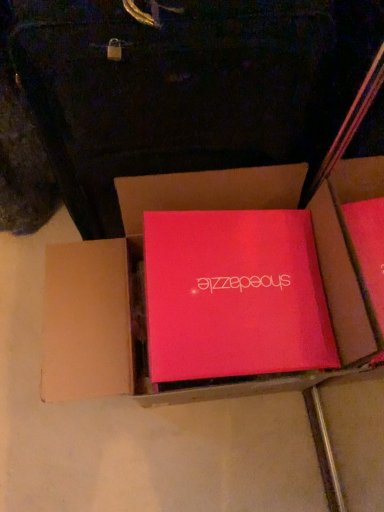
The image size is (384, 512). I want to click on matte pink box at center, arranged as the 2th box when viewed from the left, so click(x=234, y=295).

What do you see at coordinates (234, 295) in the screenshot? I see `matte pink box at center, arranged as the 2th box when viewed from the left` at bounding box center [234, 295].

At what (x,y) coordinates should I click in order to perform the action: click on matte red box at center, which is the 2th box from right to left. Please return your answer as a coordinate pair (x, y). This screenshot has height=512, width=384. Looking at the image, I should click on (218, 286).

What do you see at coordinates (218, 286) in the screenshot? I see `matte red box at center, the 1th box viewed from the left` at bounding box center [218, 286].

Identify the location of matte pink box at center, the 1th box in the right-to-left sequence. This screenshot has width=384, height=512. (234, 295).

Between matte red box at center, the 1th box viewed from the left, and matte pink box at center, the 1th box in the right-to-left sequence, which one appears on the left side from the viewer's perspective?

From the viewer's perspective, matte red box at center, the 1th box viewed from the left, appears more on the left side.

Looking at this image, who is more distant, matte red box at center, the 1th box viewed from the left, or matte pink box at center, arranged as the 2th box when viewed from the left?

matte pink box at center, arranged as the 2th box when viewed from the left, is more distant.

Considering the positions of point (71, 250) and point (239, 264), is point (71, 250) closer or farther from the camera than point (239, 264)?

Point (71, 250) is farther from the camera than point (239, 264).

From the image's perspective, which one is positioned lower, matte red box at center, which is the 2th box from right to left, or matte pink box at center, arranged as the 2th box when viewed from the left?

matte red box at center, which is the 2th box from right to left, from the image's perspective.

From a real-world perspective, is matte red box at center, which is the 2th box from right to left, located higher than matte pink box at center, the 1th box in the right-to-left sequence?

No, from a real-world perspective, matte red box at center, which is the 2th box from right to left, is not above matte pink box at center, the 1th box in the right-to-left sequence.

Can you confirm if matte red box at center, which is the 2th box from right to left, is thinner than matte pink box at center, the 1th box in the right-to-left sequence?

In fact, matte red box at center, which is the 2th box from right to left, might be wider than matte pink box at center, the 1th box in the right-to-left sequence.

Is matte red box at center, the 1th box viewed from the left, taller than matte pink box at center, arranged as the 2th box when viewed from the left?

Yes.

Who is smaller, matte red box at center, the 1th box viewed from the left, or matte pink box at center, arranged as the 2th box when viewed from the left?

Smaller between the two is matte pink box at center, arranged as the 2th box when viewed from the left.

Looking at this image, would you say matte red box at center, which is the 2th box from right to left, is inside or outside matte pink box at center, the 1th box in the right-to-left sequence?

matte red box at center, which is the 2th box from right to left, exists outside the volume of matte pink box at center, the 1th box in the right-to-left sequence.

Are matte red box at center, the 1th box viewed from the left, and matte pink box at center, the 1th box in the right-to-left sequence, making contact?

Yes, matte red box at center, the 1th box viewed from the left, is right next to matte pink box at center, the 1th box in the right-to-left sequence, and making contact.

Is matte red box at center, the 1th box viewed from the left, oriented towards matte pink box at center, arranged as the 2th box when viewed from the left?

Yes, matte red box at center, the 1th box viewed from the left, is facing matte pink box at center, arranged as the 2th box when viewed from the left.

What's the angular difference between matte red box at center, the 1th box viewed from the left, and matte pink box at center, arranged as the 2th box when viewed from the left,'s facing directions?

The angular difference between matte red box at center, the 1th box viewed from the left, and matte pink box at center, arranged as the 2th box when viewed from the left, is 4.69 degrees.

How distant is matte red box at center, the 1th box viewed from the left, from matte pink box at center, the 1th box in the right-to-left sequence?

matte red box at center, the 1th box viewed from the left, and matte pink box at center, the 1th box in the right-to-left sequence, are 1.88 inches apart from each other.

You are a GUI agent. You are given a task and a screenshot of the screen. Output one action in this format:
    pyautogui.click(x=<x>, y=<y>)
    Task: Click on the box on the left of matte pink box at center, arranged as the 2th box when viewed from the left
    The image size is (384, 512).
    Given the screenshot: What is the action you would take?
    pyautogui.click(x=218, y=286)

Is matte pink box at center, the 1th box in the right-to-left sequence, to the right of matte red box at center, the 1th box viewed from the left, from the viewer's perspective?

Yes.

Which object is closer to the camera, matte pink box at center, the 1th box in the right-to-left sequence, or matte red box at center, which is the 2th box from right to left?

matte red box at center, which is the 2th box from right to left, is more forward.

Is point (293, 224) positioned after point (366, 183)?

That is False.

From the image's perspective, relative to matte red box at center, the 1th box viewed from the left, is matte pink box at center, the 1th box in the right-to-left sequence, above or below?

From the image's perspective, matte pink box at center, the 1th box in the right-to-left sequence, appears above matte red box at center, the 1th box viewed from the left.

From a real-world perspective, between matte pink box at center, arranged as the 2th box when viewed from the left, and matte red box at center, which is the 2th box from right to left, who is vertically higher?

matte pink box at center, arranged as the 2th box when viewed from the left, from a real-world perspective.

Looking at their sizes, would you say matte pink box at center, the 1th box in the right-to-left sequence, is wider or thinner than matte red box at center, which is the 2th box from right to left?

matte pink box at center, the 1th box in the right-to-left sequence, is thinner than matte red box at center, which is the 2th box from right to left.

From their relative heights in the image, would you say matte pink box at center, the 1th box in the right-to-left sequence, is taller or shorter than matte red box at center, the 1th box viewed from the left?

In the image, matte pink box at center, the 1th box in the right-to-left sequence, appears to be shorter than matte red box at center, the 1th box viewed from the left.

Who is smaller, matte pink box at center, arranged as the 2th box when viewed from the left, or matte red box at center, the 1th box viewed from the left?

With smaller size is matte pink box at center, arranged as the 2th box when viewed from the left.

Looking at this image, is matte red box at center, the 1th box viewed from the left, a part of matte pink box at center, arranged as the 2th box when viewed from the left?

Actually, matte red box at center, the 1th box viewed from the left, is outside matte pink box at center, arranged as the 2th box when viewed from the left.

Is matte pink box at center, arranged as the 2th box when viewed from the left, next to matte red box at center, the 1th box viewed from the left?

Yes, matte pink box at center, arranged as the 2th box when viewed from the left, is next to matte red box at center, the 1th box viewed from the left.

Is matte pink box at center, the 1th box in the right-to-left sequence, oriented away from matte red box at center, the 1th box viewed from the left?

That's right, matte pink box at center, the 1th box in the right-to-left sequence, is facing away from matte red box at center, the 1th box viewed from the left.

Measure the distance between matte pink box at center, arranged as the 2th box when viewed from the left, and matte red box at center, which is the 2th box from right to left.

matte pink box at center, arranged as the 2th box when viewed from the left, is 1.88 inches away from matte red box at center, which is the 2th box from right to left.

Image resolution: width=384 pixels, height=512 pixels. What are the coordinates of `box lying on the right of matte red box at center, the 1th box viewed from the left` in the screenshot? It's located at (234, 295).

The image size is (384, 512). I want to click on box located below the matte pink box at center, arranged as the 2th box when viewed from the left (from the image's perspective), so click(x=218, y=286).

Image resolution: width=384 pixels, height=512 pixels. I want to click on box below the matte pink box at center, arranged as the 2th box when viewed from the left (from a real-world perspective), so click(218, 286).